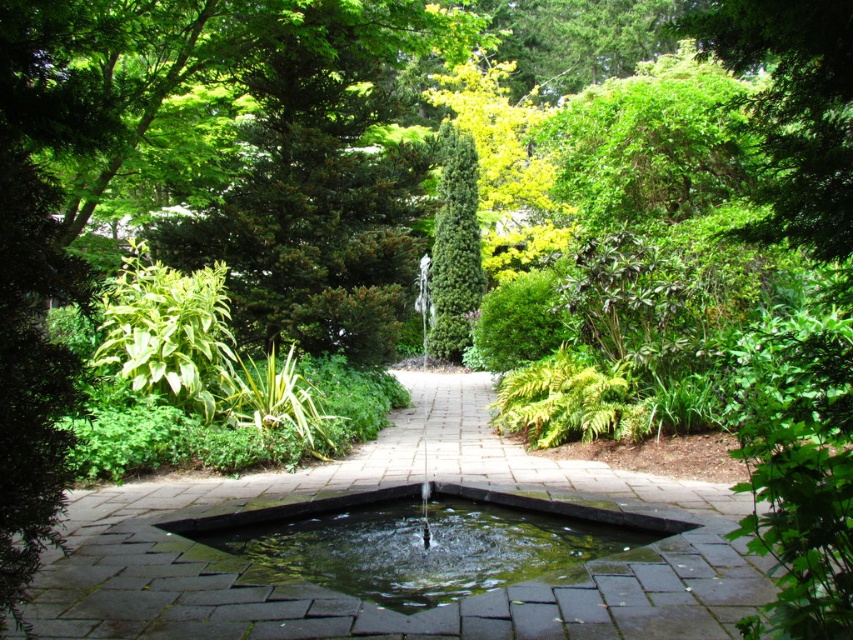
Question: Considering the real-world distances, which object is closest to the green mossy water at center?

Choices:
 (A) green leafy bush at upper left
 (B) green glossy conifer at center

Answer: (A)

Question: Does green leafy bush at upper left lie behind green glossy conifer at center?

Choices:
 (A) no
 (B) yes

Answer: (A)

Question: From the image, what is the correct spatial relationship of green leafy bush at upper left in relation to green glossy conifer at center?

Choices:
 (A) left
 (B) right

Answer: (A)

Question: Which of the following is the closest to the observer?

Choices:
 (A) (479, 282)
 (B) (222, 522)
 (C) (234, 394)

Answer: (B)

Question: Where is green mossy water at center located in relation to green leafy bush at upper left in the image?

Choices:
 (A) above
 (B) below

Answer: (B)

Question: Among these objects, which one is nearest to the camera?

Choices:
 (A) green leafy bush at upper left
 (B) green mossy water at center

Answer: (B)